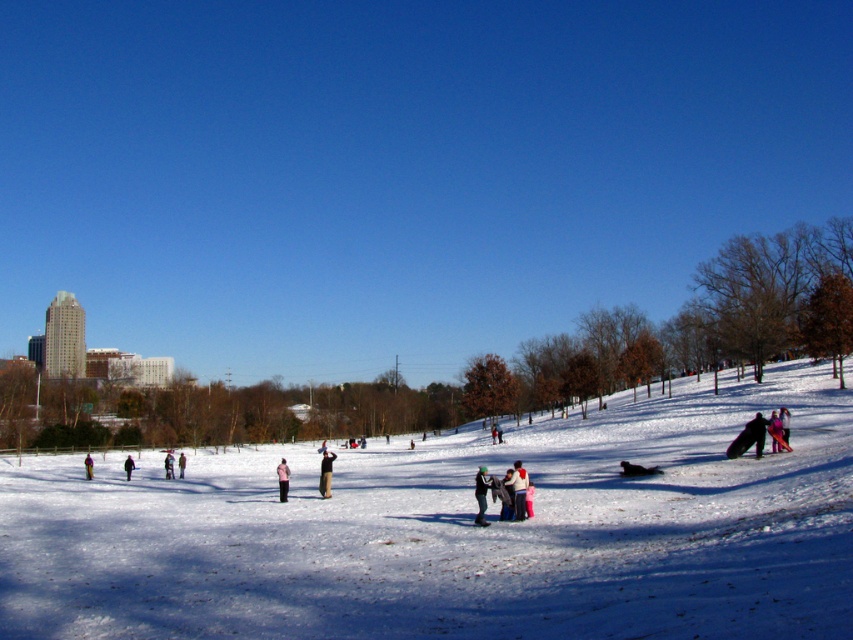
Is white snow pants at center wider than light brown snowsuit at center?

Yes, white snow pants at center is wider than light brown snowsuit at center.

Measure the distance between white snow pants at center and camera.

white snow pants at center and camera are 55.15 meters apart from each other.

Identify the location of white snow pants at center. (167, 465).

Between green wool jacket at center and light brown snowsuit at center, which one has less height?

With less height is light brown snowsuit at center.

From the picture: Who is more distant from viewer, (483, 474) or (181, 465)?

Positioned behind is point (181, 465).

Is point (483, 524) positioned behind point (183, 477)?

No, it is in front of (183, 477).

Where is `green wool jacket at center`? green wool jacket at center is located at coordinates (482, 493).

Identify the location of dark gray jacket at lower right. (749, 436).

Who is shorter, dark gray jacket at lower right or light pink fabric at center?

dark gray jacket at lower right is shorter.

The image size is (853, 640). I want to click on dark gray jacket at lower right, so click(x=749, y=436).